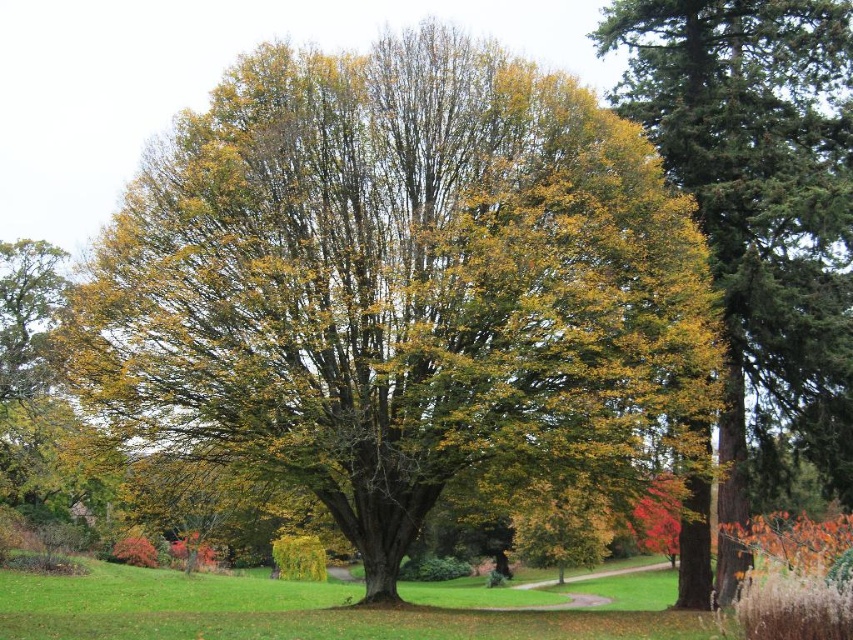
Is green leafy tree at center closer to camera compared to green textured tree at right?

Yes, it is.

Between point (230, 346) and point (732, 49), which one is positioned in front?

Point (230, 346)

Where is `green leafy tree at center`? The image size is (853, 640). green leafy tree at center is located at coordinates (399, 284).